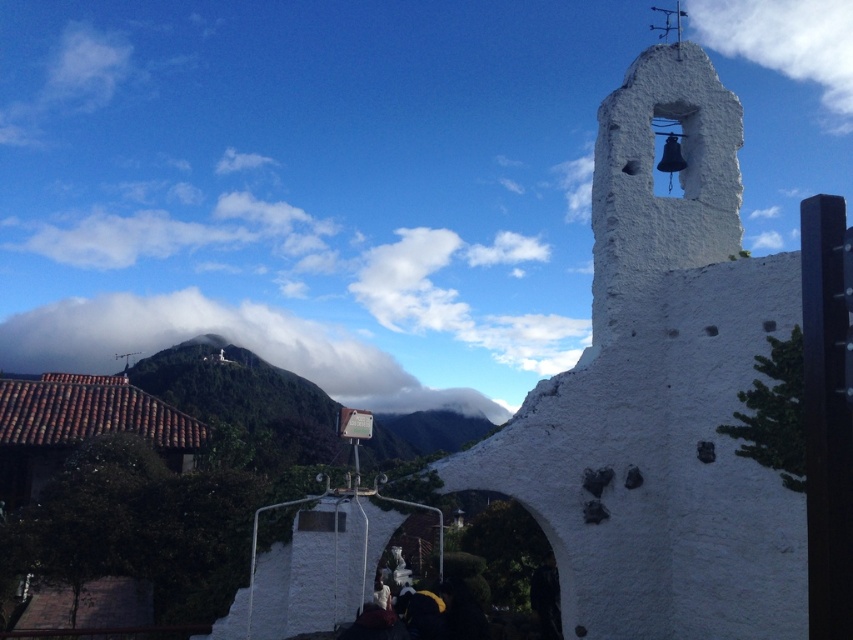
Question: Does green grassy hill at lower left come behind white fluffy cloud at upper center?

Choices:
 (A) yes
 (B) no

Answer: (B)

Question: Which point is closer to the camera taking this photo?

Choices:
 (A) (277, 339)
 (B) (766, 1)
 (C) (207, 392)

Answer: (C)

Question: Is green grassy hill at lower left smaller than white fluffy cloud at upper center?

Choices:
 (A) yes
 (B) no

Answer: (B)

Question: Which point appears closest to the camera in this image?

Choices:
 (A) (312, 410)
 (B) (764, 60)
 (C) (270, 356)

Answer: (A)

Question: Can you confirm if white fluffy cloud at upper left is bigger than white fluffy cloud at upper center?

Choices:
 (A) yes
 (B) no

Answer: (A)

Question: Among these objects, which one is farthest from the camera?

Choices:
 (A) white fluffy cloud at upper left
 (B) white fluffy cloud at upper center

Answer: (B)